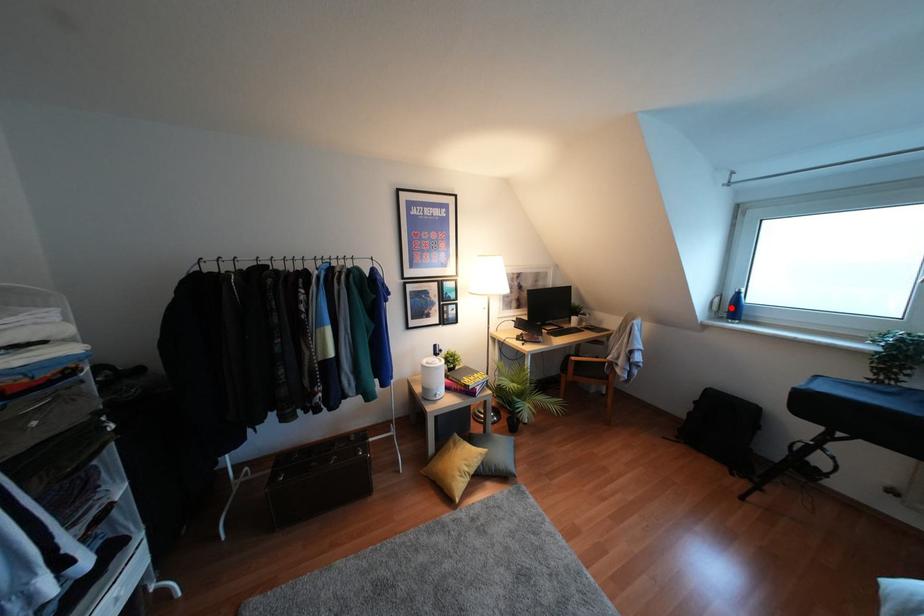
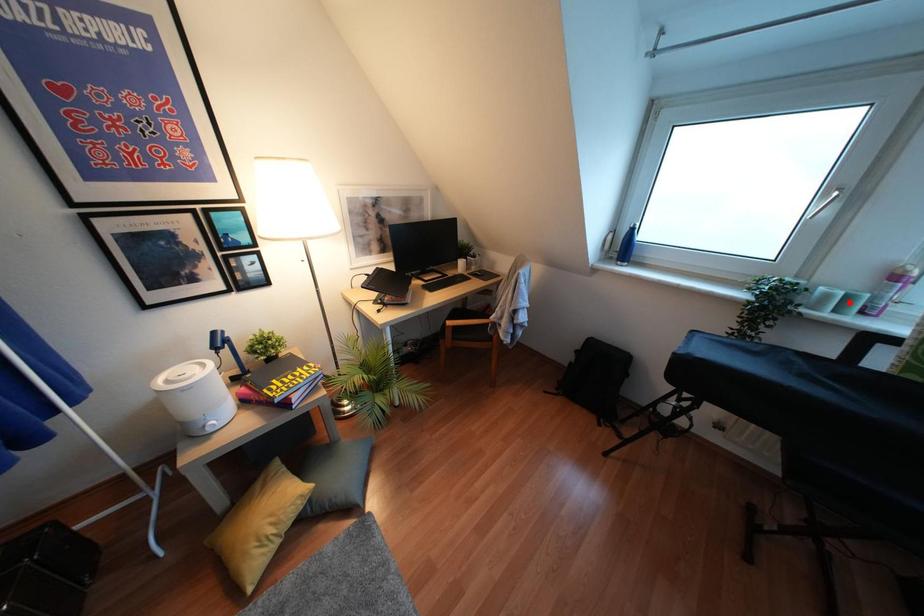
I am providing you with two images of the same scene from different viewpoints. A red point is marked on the first image and another point is marked on the second image. Is the marked point in image1 the same physical position as the marked point in image2?

No